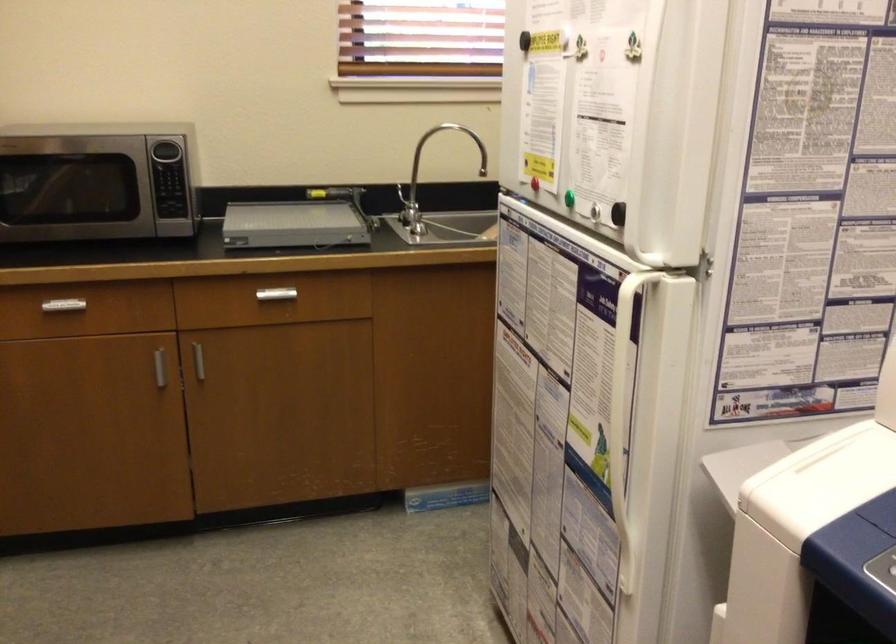
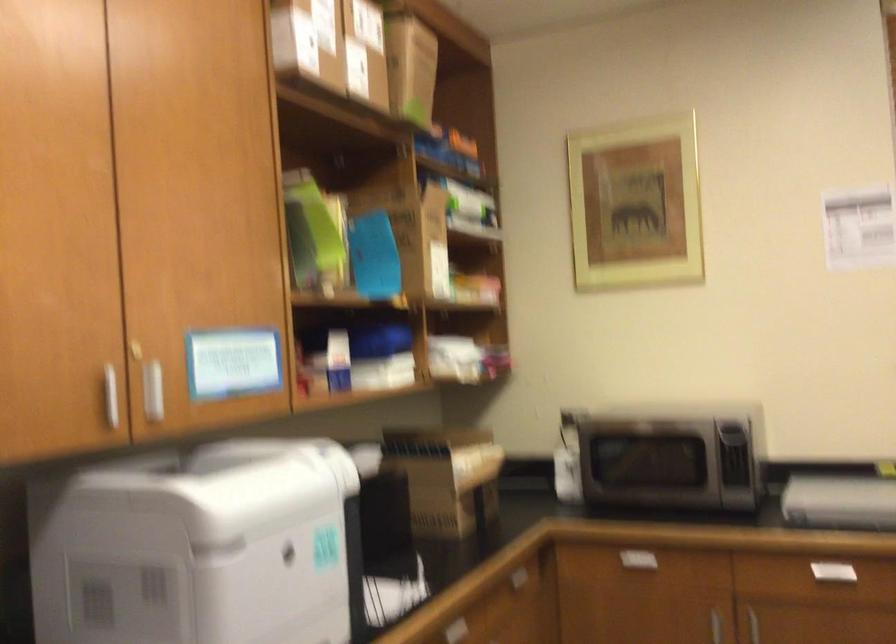
In the second image, find the point that corresponds to (x=73, y=315) in the first image.

(634, 565)